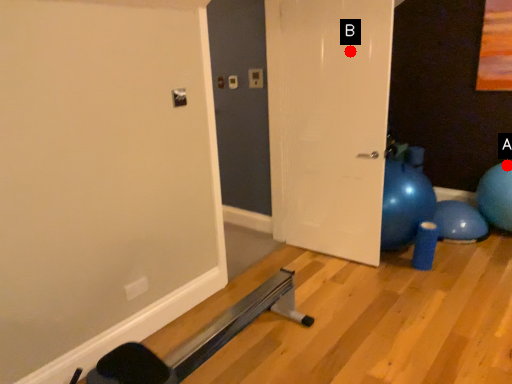
Question: Two points are circled on the image, labeled by A and B beside each circle. Which point is farther from the camera taking this photo?

Choices:
 (A) A is further
 (B) B is further

Answer: (A)